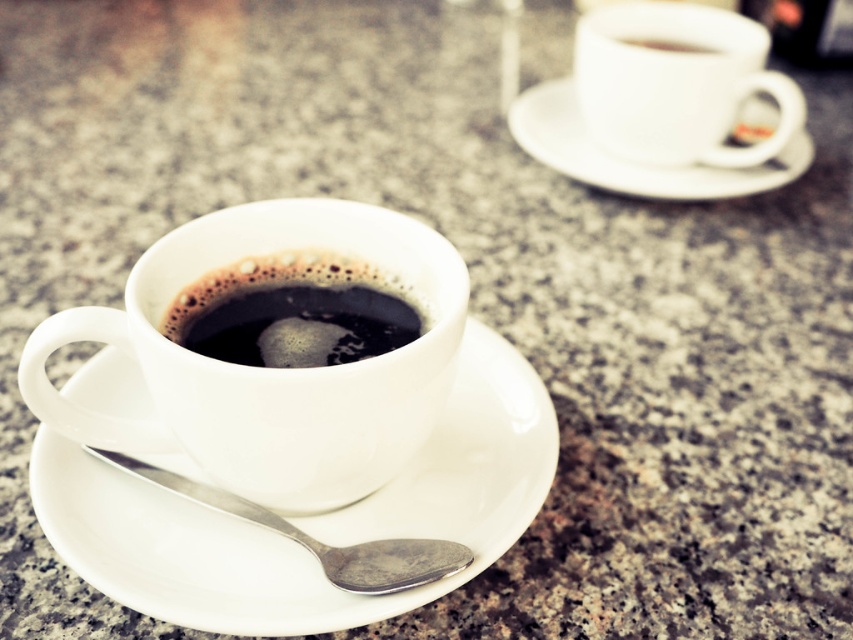
Question: Which of the following is the farthest from the observer?

Choices:
 (A) (258, 515)
 (B) (453, 579)
 (C) (540, 120)
 (D) (285, 352)

Answer: (C)

Question: From the image, what is the correct spatial relationship of black glossy coffee at center in relation to white ceramic saucer at upper right?

Choices:
 (A) right
 (B) left

Answer: (B)

Question: Estimate the real-world distances between objects in this image. Which object is farther from the white ceramic saucer at upper right?

Choices:
 (A) white glossy saucer at lower left
 (B) black glossy coffee at center

Answer: (B)

Question: Is white ceramic saucer at upper right thinner than silver metallic spoon at lower center?

Choices:
 (A) no
 (B) yes

Answer: (A)

Question: Is black glossy coffee at center wider than white ceramic saucer at upper right?

Choices:
 (A) no
 (B) yes

Answer: (A)

Question: Which point is farther from the camera taking this photo?

Choices:
 (A) (213, 291)
 (B) (142, 476)

Answer: (A)